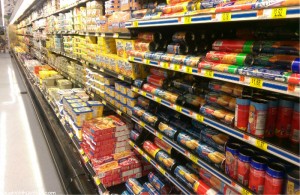
The image size is (300, 195). Find the location of `store floor`. store floor is located at coordinates (12, 127).